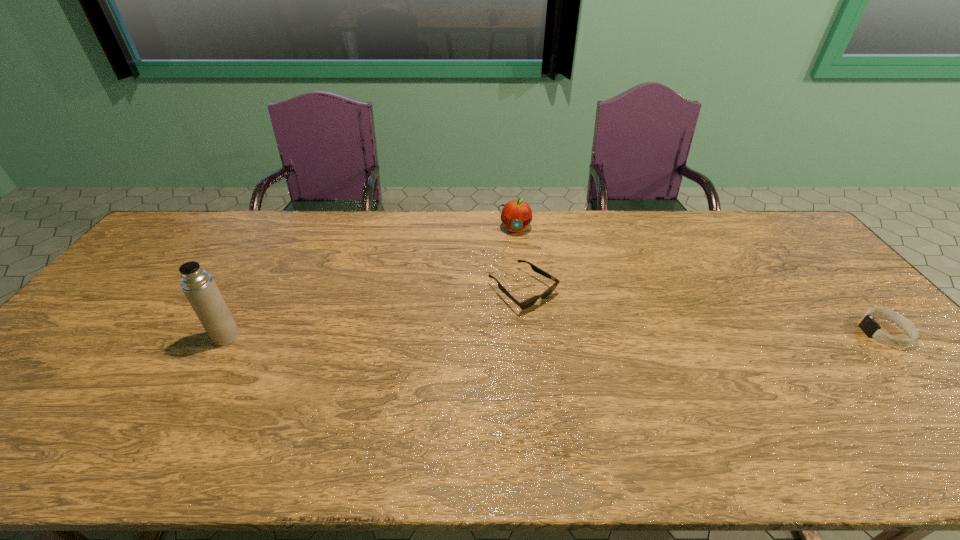
In the image, there is a desktop. Where is `vacant space at the right edge`? The height and width of the screenshot is (540, 960). vacant space at the right edge is located at coordinates (838, 284).

Where is `vacant area that lies between the leftmost object and the wristband`? vacant area that lies between the leftmost object and the wristband is located at coordinates (555, 334).

Locate an element on the screen. free area in between the apple and the leftmost object is located at coordinates tap(371, 282).

Identify the location of free space between the sunglasses and the farthest object. The image size is (960, 540). (518, 259).

You are a GUI agent. You are given a task and a screenshot of the screen. Output one action in this format:
    pyautogui.click(x=<x>, y=<y>)
    Task: Click on the vacant space that's between the second farthest object and the second tallest object
    Image resolution: width=960 pixels, height=540 pixels.
    Given the screenshot: What is the action you would take?
    pyautogui.click(x=518, y=259)

Identify the location of free spot between the third shortest object and the wristband. This screenshot has height=540, width=960. (700, 280).

Image resolution: width=960 pixels, height=540 pixels. Find the location of `vacant area that lies between the third nearest object and the apple`. vacant area that lies between the third nearest object and the apple is located at coordinates (518, 259).

Where is `vacant region between the sunglasses and the tallest object`? This screenshot has height=540, width=960. vacant region between the sunglasses and the tallest object is located at coordinates (374, 313).

Where is `empty space between the rightmost object and the leftmost object`? This screenshot has width=960, height=540. empty space between the rightmost object and the leftmost object is located at coordinates (555, 334).

I want to click on free spot between the sunglasses and the wristband, so click(704, 311).